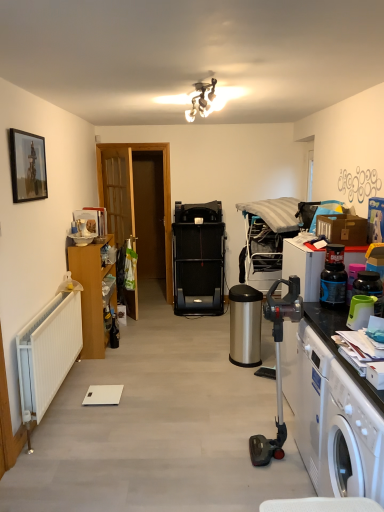
Question: Can you confirm if blue plastic bottle at right is wider than white plastic washing machine at lower right?

Choices:
 (A) yes
 (B) no

Answer: (B)

Question: Considering the relative sizes of blue plastic bottle at right and white plastic washing machine at lower right in the image provided, is blue plastic bottle at right shorter than white plastic washing machine at lower right?

Choices:
 (A) yes
 (B) no

Answer: (A)

Question: Is blue plastic bottle at right further to camera compared to white plastic washing machine at lower right?

Choices:
 (A) yes
 (B) no

Answer: (A)

Question: Can you confirm if blue plastic bottle at right is taller than white plastic washing machine at lower right?

Choices:
 (A) no
 (B) yes

Answer: (A)

Question: Is blue plastic bottle at right bigger than white plastic washing machine at lower right?

Choices:
 (A) yes
 (B) no

Answer: (B)

Question: Is wooden cabinet at left situated inside white plastic washing machine at lower right or outside?

Choices:
 (A) outside
 (B) inside

Answer: (A)

Question: Is point (94, 257) positioned closer to the camera than point (326, 408)?

Choices:
 (A) closer
 (B) farther

Answer: (B)

Question: From a real-world perspective, is wooden cabinet at left physically located above or below white plastic washing machine at lower right?

Choices:
 (A) above
 (B) below

Answer: (A)

Question: From their relative heights in the image, would you say wooden cabinet at left is taller or shorter than white plastic washing machine at lower right?

Choices:
 (A) short
 (B) tall

Answer: (B)

Question: Is wooden door at left in front of or behind white plastic washing machine at lower right in the image?

Choices:
 (A) front
 (B) behind

Answer: (B)

Question: Considering the positions of wooden door at left and white plastic washing machine at lower right in the image, is wooden door at left wider or thinner than white plastic washing machine at lower right?

Choices:
 (A) thin
 (B) wide

Answer: (A)

Question: In terms of height, does wooden door at left look taller or shorter compared to white plastic washing machine at lower right?

Choices:
 (A) short
 (B) tall

Answer: (B)

Question: Visually, is wooden door at left positioned to the left or to the right of white plastic washing machine at lower right?

Choices:
 (A) left
 (B) right

Answer: (A)

Question: From a real-world perspective, is white plastic washing machine at lower right positioned above or below matte black picture frame at upper left?

Choices:
 (A) above
 (B) below

Answer: (B)

Question: Is white plastic washing machine at lower right inside the boundaries of matte black picture frame at upper left, or outside?

Choices:
 (A) outside
 (B) inside

Answer: (A)